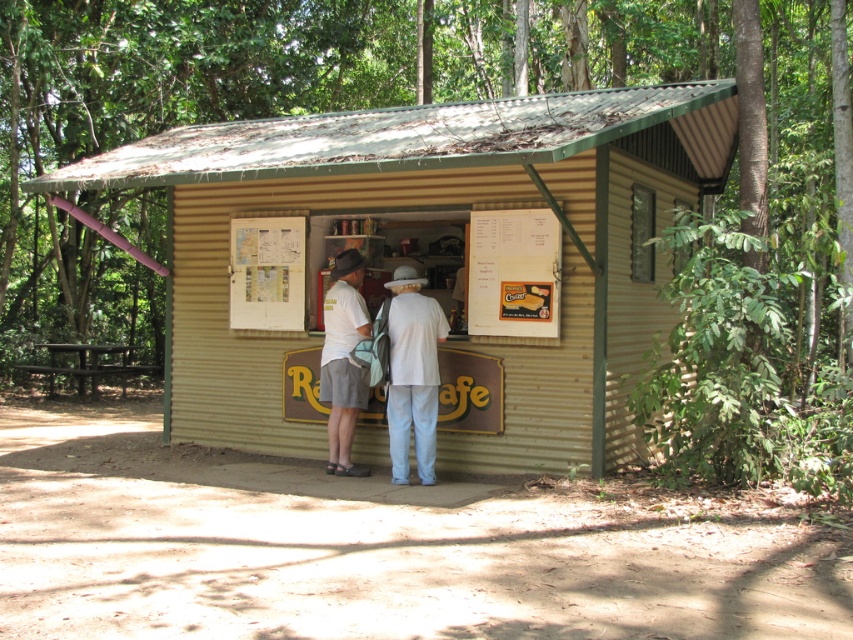
Question: Which point is farther to the camera?

Choices:
 (A) matte white shirt at center
 (B) corrugated metal hut at center
 (C) white cotton shirt at center

Answer: (B)

Question: Which object is the closest to the corrugated metal hut at center?

Choices:
 (A) matte white shirt at center
 (B) white cotton shirt at center

Answer: (B)

Question: Does corrugated metal hut at center have a lesser width compared to matte white shirt at center?

Choices:
 (A) no
 (B) yes

Answer: (B)

Question: Which object appears farthest from the camera in this image?

Choices:
 (A) white cotton shirt at center
 (B) matte white shirt at center
 (C) corrugated metal hut at center

Answer: (C)

Question: Does white cotton shirt at center have a greater width compared to matte white shirt at center?

Choices:
 (A) no
 (B) yes

Answer: (B)

Question: Does corrugated metal hut at center have a lesser width compared to matte white shirt at center?

Choices:
 (A) yes
 (B) no

Answer: (A)